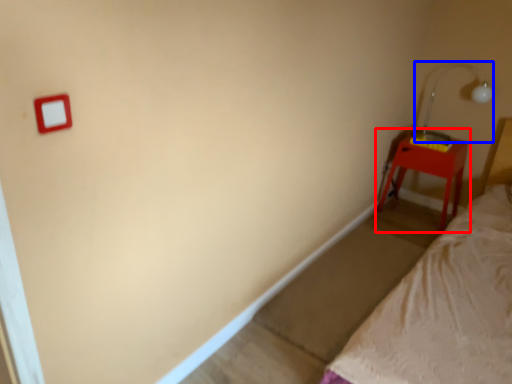
Question: Among these objects, which one is nearest to the camera, nightstand (highlighted by a red box) or lamp (highlighted by a blue box)?

Choices:
 (A) nightstand
 (B) lamp

Answer: (B)